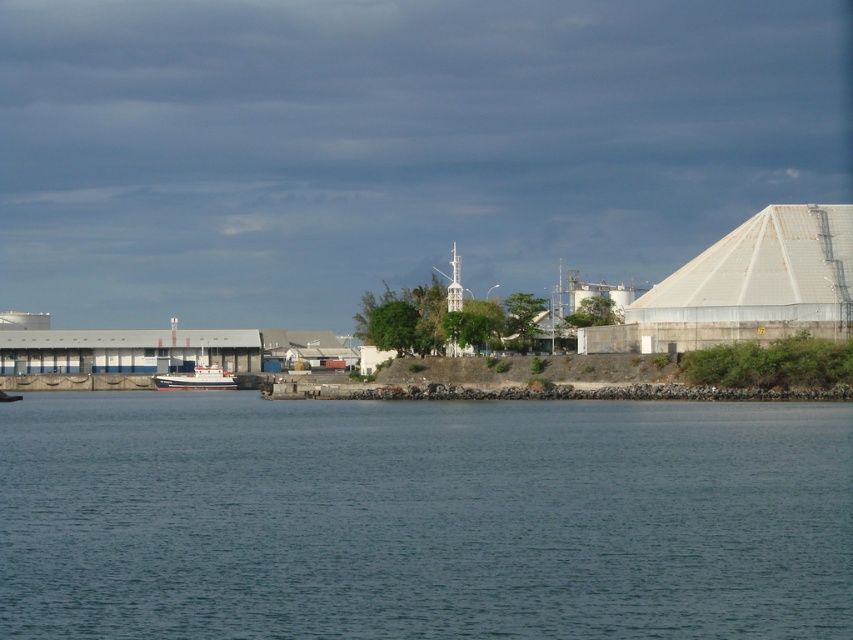
You are standing at the waterfront and want to determine which of the two points, point (415,566) or point (207,376), is closer to you. Based on the scene, which point is nearer?

Point (415,566) is closer to the viewer than point (207,376).

You are a photographer trying to capture the waterfront scene. You want to ensure that the blue water at lower center and the white matte boat at center are both clearly visible in your shot. Given their sizes, which object should you focus on to ensure it takes up more space in the photo?

The blue water at lower center should be focused on because its width is larger than the white matte boat at center, making it occupy more space in the photo.